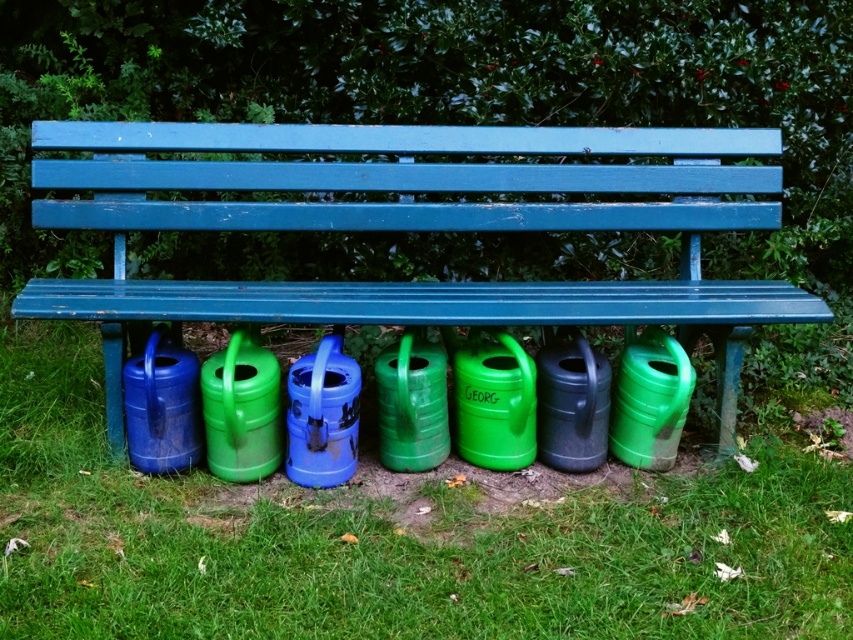
Question: Does green matte watering cans at lower center have a greater width compared to matte blue bench at center?

Choices:
 (A) no
 (B) yes

Answer: (B)

Question: Can you confirm if green matte watering cans at lower center is thinner than matte blue bench at center?

Choices:
 (A) yes
 (B) no

Answer: (B)

Question: Can you confirm if green matte watering cans at lower center is wider than matte blue bench at center?

Choices:
 (A) no
 (B) yes

Answer: (B)

Question: Which point appears closest to the camera in this image?

Choices:
 (A) (782, 604)
 (B) (270, 180)

Answer: (A)